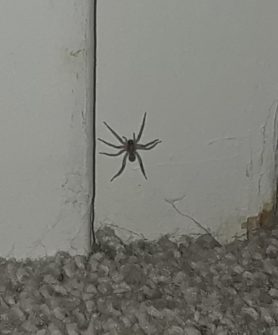
The height and width of the screenshot is (335, 278). Identify the location of empty space on the right of the wall. (223, 105).